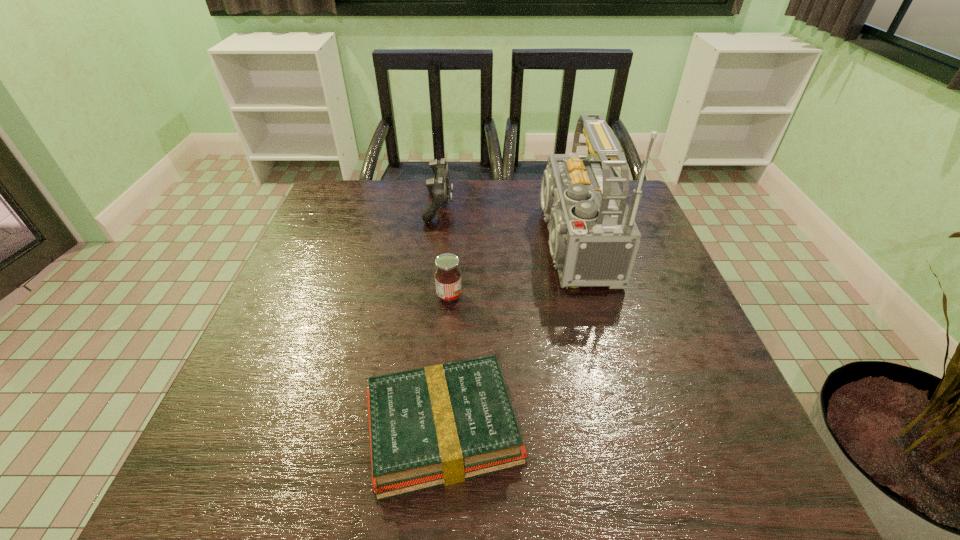
Locate an element on the screen. vacant space at the right edge is located at coordinates (661, 383).

In the image, there is a desktop. Identify the location of vacant space at the far left corner. The width and height of the screenshot is (960, 540). (349, 194).

Where is `free spot between the control and the jam`? Image resolution: width=960 pixels, height=540 pixels. free spot between the control and the jam is located at coordinates (444, 251).

Where is `vacant space in between the nearest object and the tallest object`? Image resolution: width=960 pixels, height=540 pixels. vacant space in between the nearest object and the tallest object is located at coordinates tap(504, 336).

What are the coordinates of `empty location between the rightmost object and the hardback book` in the screenshot? It's located at (504, 336).

Locate an element on the screen. The image size is (960, 540). free spot between the nearest object and the rightmost object is located at coordinates (504, 336).

Where is `free area in between the jam and the control`? Image resolution: width=960 pixels, height=540 pixels. free area in between the jam and the control is located at coordinates 444,251.

Where is `free space between the control and the hardback book`? free space between the control and the hardback book is located at coordinates (442, 318).

Where is `vacant space that is in between the control and the radio receiver`? The height and width of the screenshot is (540, 960). vacant space that is in between the control and the radio receiver is located at coordinates (502, 225).

I want to click on blank region between the control and the jam, so click(x=444, y=251).